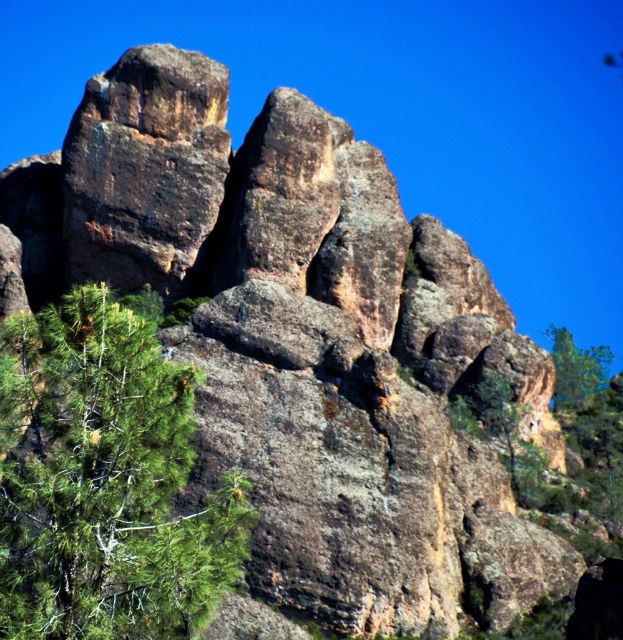
Between green leafy tree at lower left and green leafy tree at upper right, which one has less height?

green leafy tree at upper right is shorter.

Which is more to the left, green leafy tree at lower left or green leafy tree at upper right?

green leafy tree at lower left is more to the left.

The image size is (623, 640). I want to click on green leafy tree at lower left, so click(x=105, y=481).